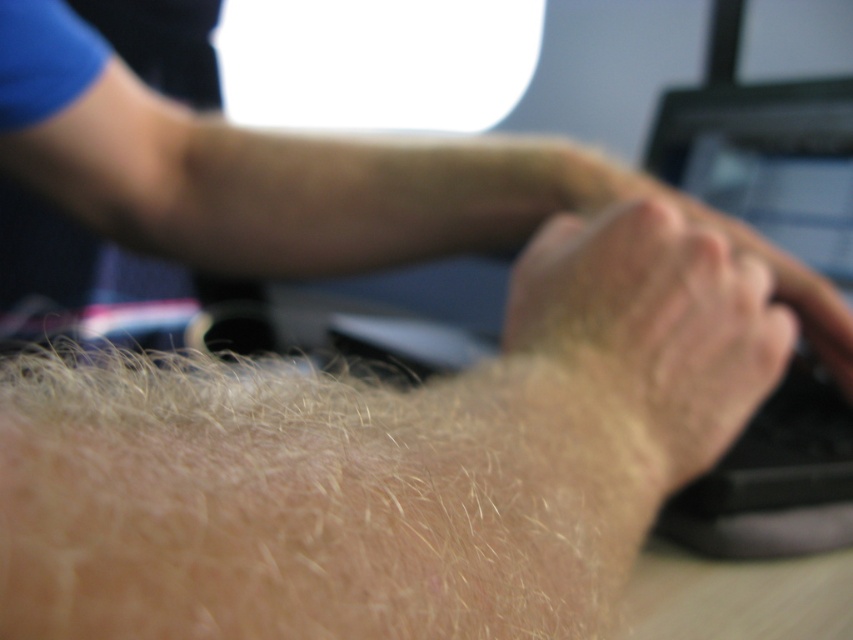
You are trying to determine the position of two points on the desk in the image. Given that you are looking at the scene from the front, which point is closer to you, point 1 at coordinates (553, 436) or point 2 at coordinates (744, 538)?

Point 1 at coordinates (553, 436) is closer to the viewer than point 2 at coordinates (744, 538).

From the picture: You are a dermatologist examining a patient. You notice a point at coordinates (643, 340) on their arm. Based on the image provided, where exactly is this point located?

The point at (643, 340) is located on dry skin at center.

You are a dermatologist examining a patient. You notice the light brown coarse hair at lower left and the dry skin at center. Which of these two features is located lower on the patient?

The light brown coarse hair at lower left is located lower than the dry skin at center.